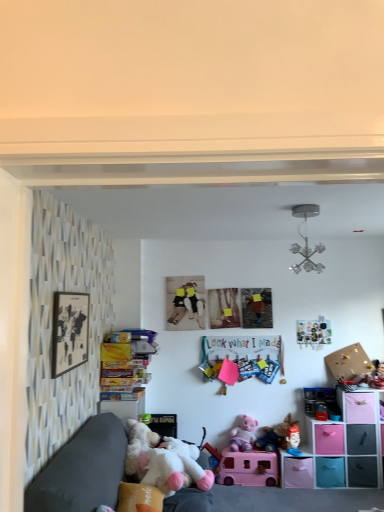
Question: Can you confirm if plush fabric toy at lower right, the 6th toy viewed from the top, is thinner than corkboard at upper right?

Choices:
 (A) yes
 (B) no

Answer: (A)

Question: Can you confirm if plush fabric toy at lower right, which ranks as the 2th toy in bottom-to-top order, is bigger than corkboard at upper right?

Choices:
 (A) yes
 (B) no

Answer: (B)

Question: Is the depth of plush fabric toy at lower right, the 6th toy viewed from the top, less than that of corkboard at upper right?

Choices:
 (A) yes
 (B) no

Answer: (A)

Question: Are plush fabric toy at lower right, which ranks as the 2th toy in bottom-to-top order, and corkboard at upper right making contact?

Choices:
 (A) yes
 (B) no

Answer: (B)

Question: From the image's perspective, is plush fabric toy at lower right, which ranks as the 2th toy in bottom-to-top order, beneath corkboard at upper right?

Choices:
 (A) yes
 (B) no

Answer: (A)

Question: Is metallic chandelier at upper center, marked as the 7th toy in a bottom-to-top arrangement, spatially inside pink plush toy at lower center, placed as the 3th toy when sorted from bottom to top, or outside of it?

Choices:
 (A) inside
 (B) outside

Answer: (B)

Question: In terms of width, does metallic chandelier at upper center, placed as the 1th toy when sorted from top to bottom, look wider or thinner when compared to pink plush toy at lower center, marked as the fifth toy in a top-to-bottom arrangement?

Choices:
 (A) thin
 (B) wide

Answer: (B)

Question: From the image's perspective, is metallic chandelier at upper center, marked as the 7th toy in a bottom-to-top arrangement, positioned above or below pink plush toy at lower center, marked as the fifth toy in a top-to-bottom arrangement?

Choices:
 (A) above
 (B) below

Answer: (A)

Question: Considering their positions, is metallic chandelier at upper center, marked as the 7th toy in a bottom-to-top arrangement, located in front of or behind pink plush toy at lower center, marked as the fifth toy in a top-to-bottom arrangement?

Choices:
 (A) behind
 (B) front

Answer: (B)

Question: In terms of size, does metallic chandelier at upper center, placed as the 1th toy when sorted from top to bottom, appear bigger or smaller than fluffy white plush at lower left, arranged as the 5th toy when ordered from the bottom?

Choices:
 (A) big
 (B) small

Answer: (B)

Question: Considering the positions of metallic chandelier at upper center, placed as the 1th toy when sorted from top to bottom, and fluffy white plush at lower left, the third toy in the top-to-bottom sequence, in the image, is metallic chandelier at upper center, placed as the 1th toy when sorted from top to bottom, wider or thinner than fluffy white plush at lower left, the third toy in the top-to-bottom sequence,?

Choices:
 (A) thin
 (B) wide

Answer: (A)

Question: Is point (296, 207) positioned closer to the camera than point (167, 450)?

Choices:
 (A) farther
 (B) closer

Answer: (B)

Question: Considering their positions, is metallic chandelier at upper center, marked as the 7th toy in a bottom-to-top arrangement, located in front of or behind fluffy white plush at lower left, the third toy in the top-to-bottom sequence?

Choices:
 (A) behind
 (B) front

Answer: (A)

Question: In terms of size, does matte black picture frame at left appear bigger or smaller than pink plush toy at lower center, placed as the 3th toy when sorted from bottom to top?

Choices:
 (A) small
 (B) big

Answer: (A)

Question: Would you say matte black picture frame at left is to the left or to the right of pink plush toy at lower center, marked as the fifth toy in a top-to-bottom arrangement, in the picture?

Choices:
 (A) left
 (B) right

Answer: (A)